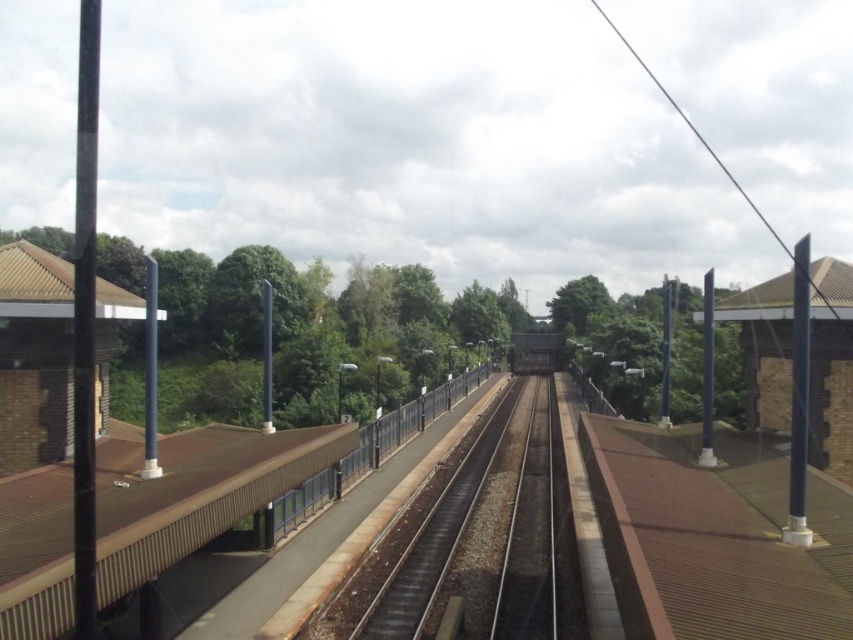
You are a maintenance worker checking the railway tracks. You notice the black asphalt track at center and the brown concrete rail at center. Which one is lower in height?

The black asphalt track at center has a lesser height compared to the brown concrete rail at center, so the black asphalt track at center is lower.

You are standing at the point labeled as point (477, 531) in the image. What is the material of the surface you are currently standing on?

The point (477, 531) corresponds to the black asphalt track at center, so the material is asphalt.